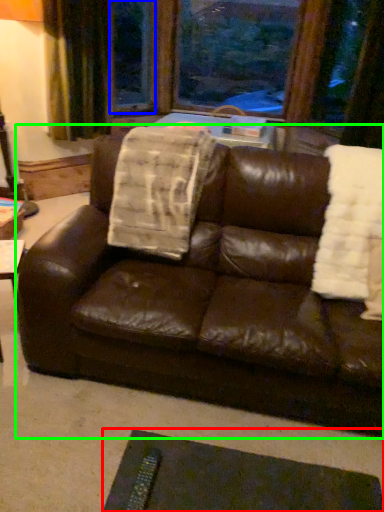
Question: Which object is the farthest from flat (highlighted by a red box)? Choose among these: window screen (highlighted by a blue box) or studio couch (highlighted by a green box).

Choices:
 (A) window screen
 (B) studio couch

Answer: (A)